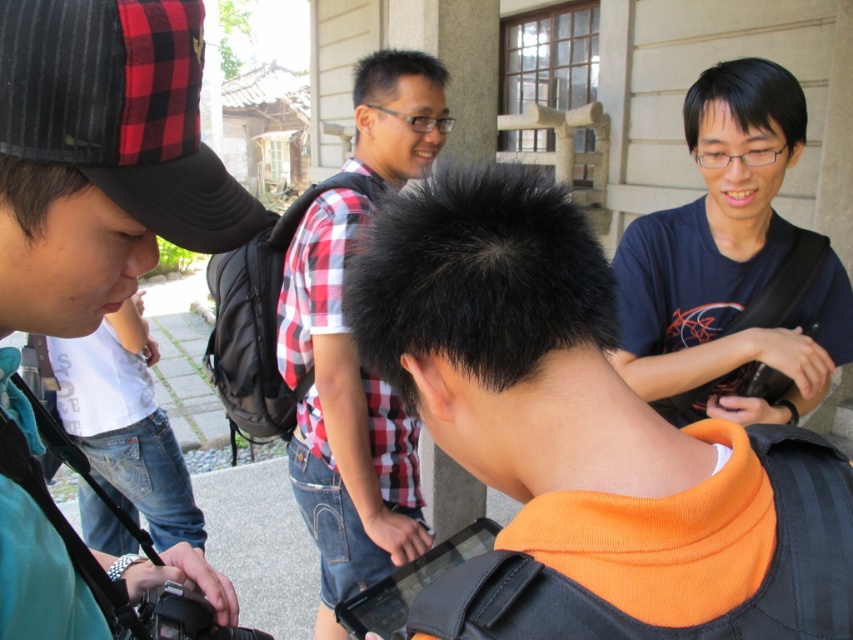
You are trying to decide which cap to wear for a hike. The green fabric cap at upper left and the black plaid baseball cap at left are options. Based on the image, which one has a wider brim?

The green fabric cap at upper left might be wider than black plaid baseball cap at left according to the description.

You are taking a photo of two points in the scene. The first point is at coordinate point (91, 13) and the second is at point (148, 45). Which point will appear larger in your photo?

Point (91, 13) is closer to the camera than point (148, 45), so it will appear larger in the photo.

You are a photographer trying to capture a group photo of the four people in the scene. To ensure the orange fleece at center is visible in the photo, where should you position the camera relative to the group?

The orange fleece at center is located at point (x=583, y=438), so positioning the camera to face the center of the group will ensure the orange fleece at center is visible.